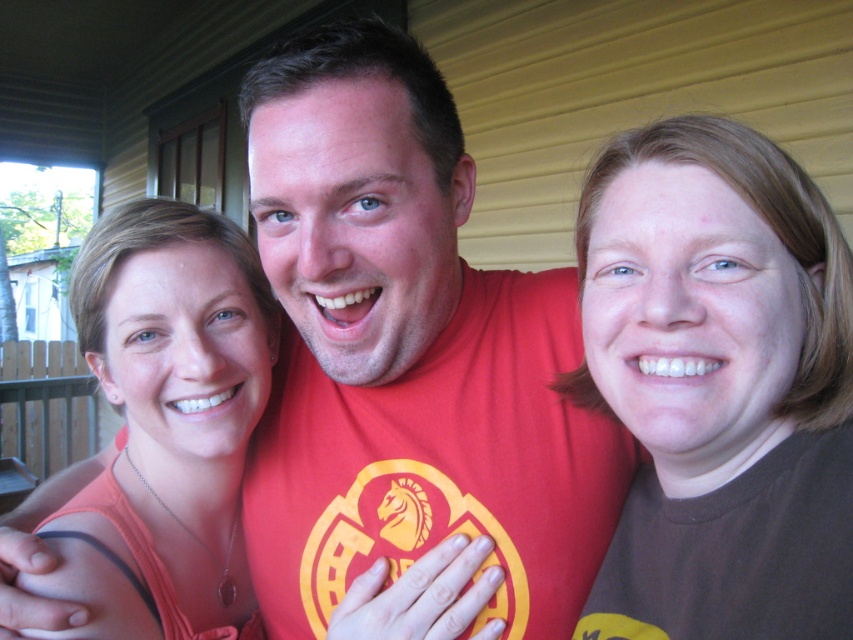
Based on the photo, you are a photographer trying to adjust the lighting for a group photo. You notice a bright light source at point (x=718, y=385). According to the scene description, which part of the group might this light source be illuminating?

The bright light source at point (x=718, y=385) is illuminating the brown matte hair at upper right.

You are a photographer trying to adjust the lighting for a group photo. The subjects are standing in a triangular formation. You need to ensure there is enough space between the brown matte hair at upper right and the matte orange tank top at center for a softbox light. Given that the softbox requires at least 40 centimeters of space to avoid harsh shadows, will the current distance suffice?

The brown matte hair at upper right and the matte orange tank top at center are 41.47 centimeters apart, which exceeds the required 40 centimeters. Therefore, the softbox light can be placed between them without causing harsh shadows.

You are taking a photo of three people standing on a porch. You need to adjust the focus to capture details of both the brown matte hair at upper right and the matte orange tank top at center. Which one should you focus on first to ensure both are in focus?

You should focus on the brown matte hair at upper right first because it is closer to the viewer than the matte orange tank top at center, so adjusting focus starting from the closer object ensures both are in focus.